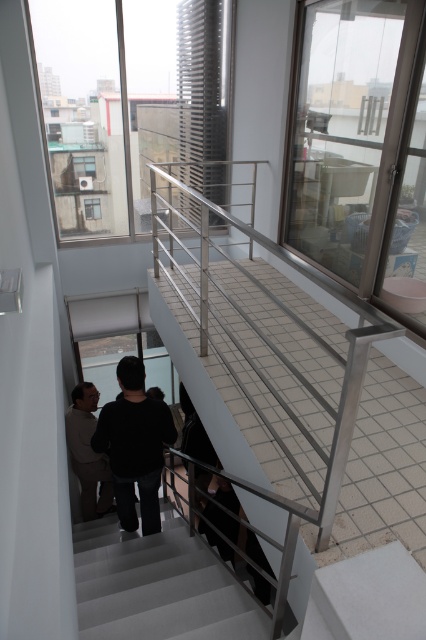
Is gray matte stair at center shorter than black matte sweater at center?

Indeed, gray matte stair at center has a lesser height compared to black matte sweater at center.

Is point (127, 598) more distant than point (129, 394)?

No, it is in front of (129, 394).

Is point (181, 628) closer to viewer compared to point (129, 371)?

Yes, point (181, 628) is in front of point (129, 371).

Identify the location of gray matte stair at center. The height and width of the screenshot is (640, 426). (158, 586).

Can you confirm if black matte sweater at center is shorter than light brown leather jacket at lower left?

Incorrect, black matte sweater at center's height does not fall short of light brown leather jacket at lower left's.

What do you see at coordinates (135, 445) in the screenshot? The height and width of the screenshot is (640, 426). I see `black matte sweater at center` at bounding box center [135, 445].

Find the location of a particular element. black matte sweater at center is located at coordinates (135, 445).

Does gray matte stair at center have a greater width compared to light brown leather jacket at lower left?

Yes, gray matte stair at center is wider than light brown leather jacket at lower left.

Is gray matte stair at center further to the viewer compared to light brown leather jacket at lower left?

No, it is in front of light brown leather jacket at lower left.

Where is `gray matte stair at center`? gray matte stair at center is located at coordinates (158, 586).